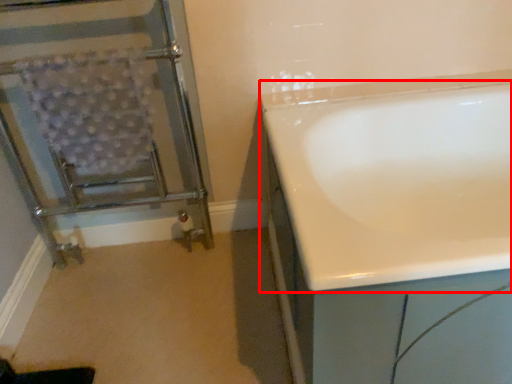
Question: In this image, where is bathtub (annotated by the red box) located relative to screen door?

Choices:
 (A) right
 (B) left

Answer: (A)